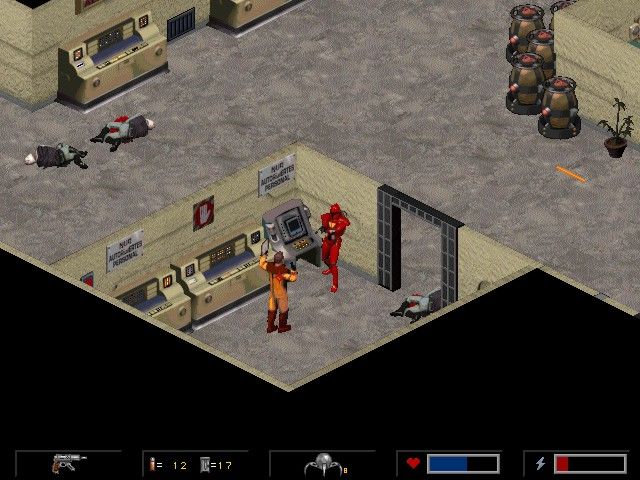
The width and height of the screenshot is (640, 480). I want to click on bars, so click(x=465, y=463), click(x=569, y=463).